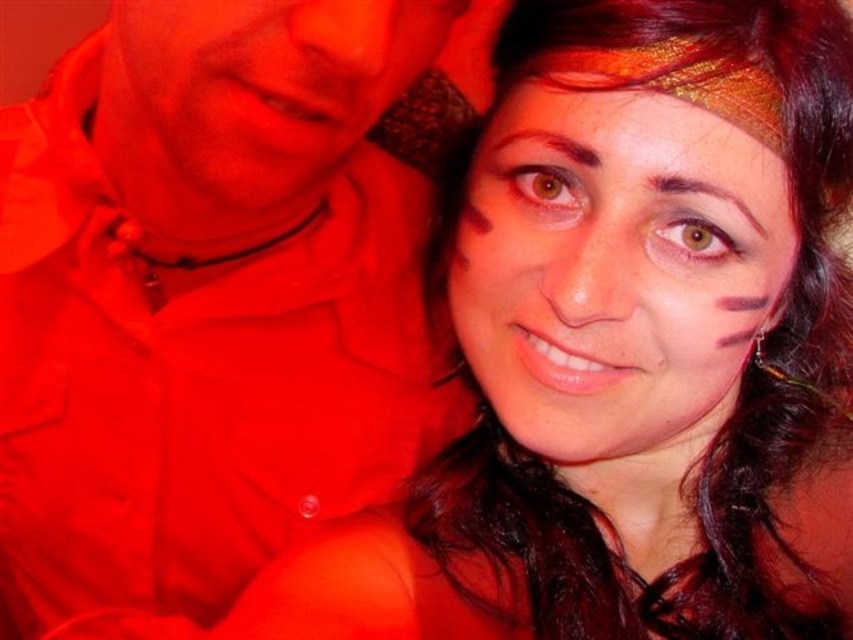
Question: Which point is closer to the camera taking this photo?

Choices:
 (A) (236, 182)
 (B) (543, 323)
 (C) (410, 449)

Answer: (A)

Question: Which object appears farthest from the camera in this image?

Choices:
 (A) matte red face at upper left
 (B) matte gold headband at upper center
 (C) matte red shirt at upper left

Answer: (B)

Question: Does matte gold headband at upper center have a greater width compared to matte red face at upper left?

Choices:
 (A) yes
 (B) no

Answer: (B)

Question: Considering the real-world distances, which object is farthest from the matte red face at upper left?

Choices:
 (A) matte gold headband at upper center
 (B) matte red shirt at upper left

Answer: (A)

Question: Is matte red shirt at upper left smaller than matte gold headband at upper center?

Choices:
 (A) no
 (B) yes

Answer: (A)

Question: Does matte red shirt at upper left lie in front of matte gold headband at upper center?

Choices:
 (A) no
 (B) yes

Answer: (B)